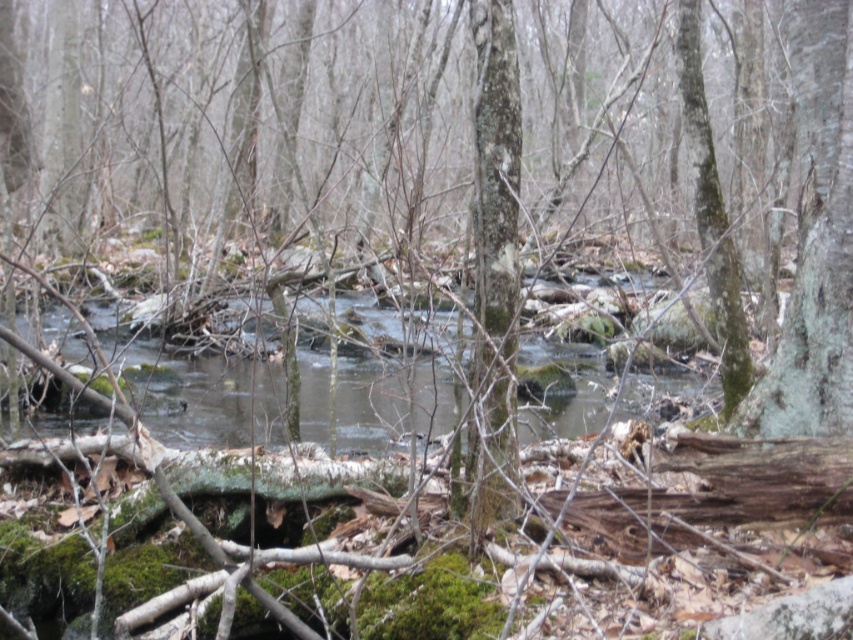
Is point (511, 38) positioned before point (312, 356)?

Yes, it is.

Who is more distant from viewer, (515, 138) or (625, 394)?

The point (625, 394) is behind.

Locate an element on the screen. The image size is (853, 640). green mossy bark tree trunk at center is located at coordinates (494, 266).